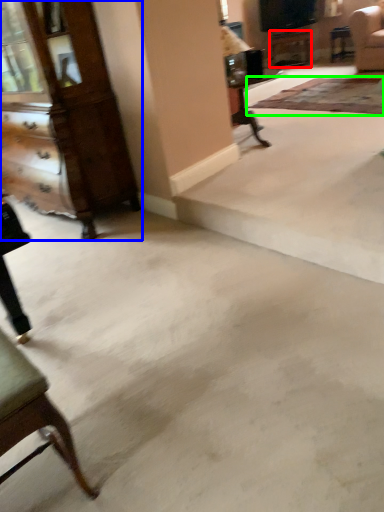
Question: Considering the real-world distances, which object is farthest from table (highlighted by a red box)? dresser (highlighted by a blue box) or mat (highlighted by a green box)?

Choices:
 (A) dresser
 (B) mat

Answer: (A)